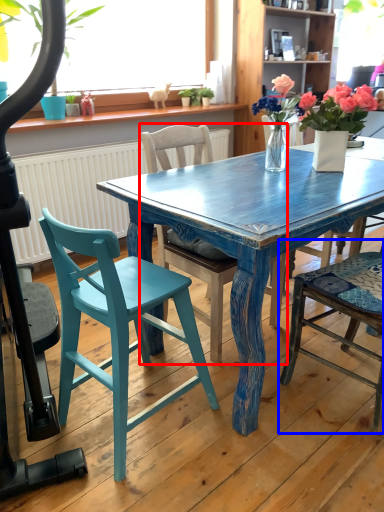
Question: Among these objects, which one is farthest to the camera, chair (highlighted by a red box) or chair (highlighted by a blue box)?

Choices:
 (A) chair
 (B) chair

Answer: (A)